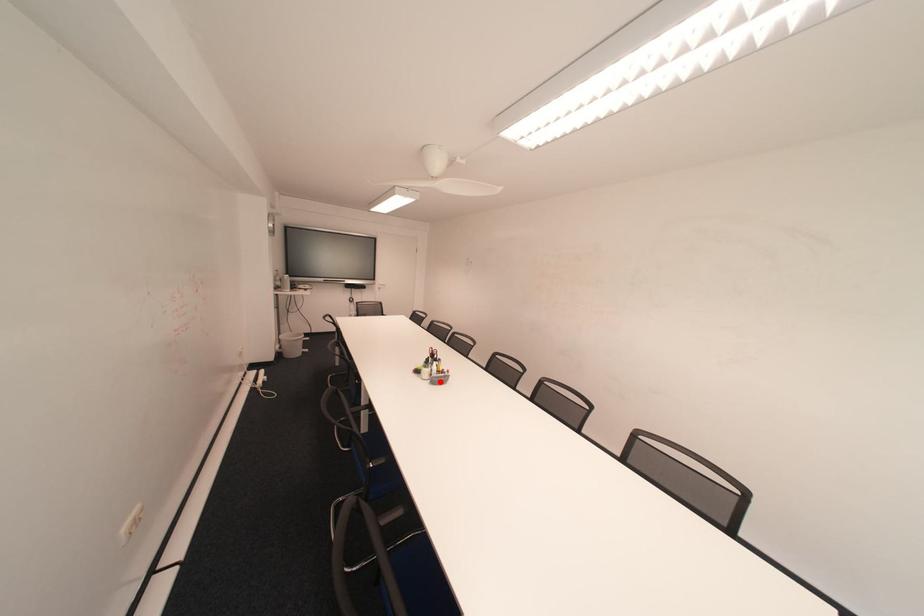
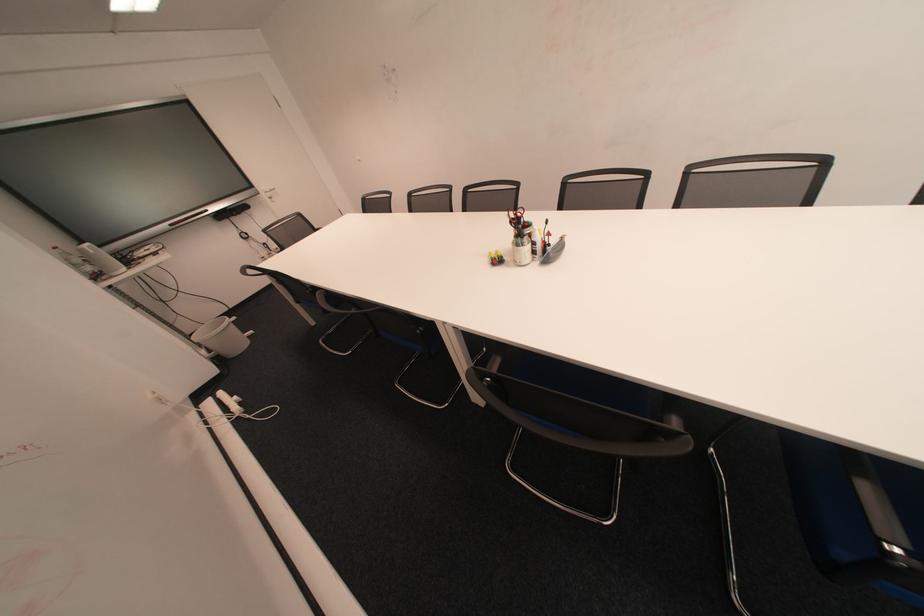
In the second image, find the point that corresponds to the highlighted location in the first image.

(550, 262)